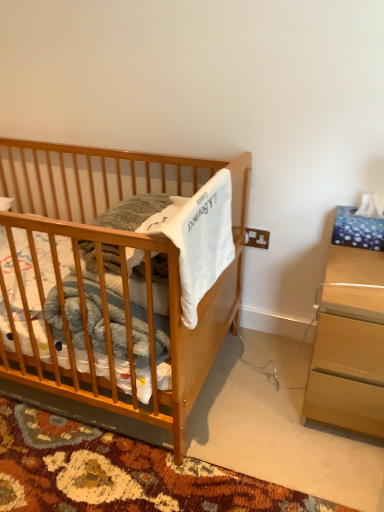
Question: Is light brown wood nightstand at right wider than light brown wooden crib at left?

Choices:
 (A) no
 (B) yes

Answer: (A)

Question: From a real-world perspective, is light brown wood nightstand at right physically above light brown wooden crib at left?

Choices:
 (A) no
 (B) yes

Answer: (A)

Question: Considering the relative sizes of light brown wood nightstand at right and light brown wooden crib at left in the image provided, is light brown wood nightstand at right taller than light brown wooden crib at left?

Choices:
 (A) no
 (B) yes

Answer: (A)

Question: Is light brown wood nightstand at right positioned before light brown wooden crib at left?

Choices:
 (A) no
 (B) yes

Answer: (A)

Question: Are light brown wood nightstand at right and light brown wooden crib at left making contact?

Choices:
 (A) yes
 (B) no

Answer: (B)

Question: Can you confirm if light brown wood nightstand at right is bigger than light brown wooden crib at left?

Choices:
 (A) yes
 (B) no

Answer: (B)

Question: Would you say light brown wood nightstand at right is part of light brown wooden crib at left's contents?

Choices:
 (A) yes
 (B) no

Answer: (B)

Question: From a real-world perspective, does light brown wooden crib at left stand above light brown wood nightstand at right?

Choices:
 (A) yes
 (B) no

Answer: (A)

Question: Does light brown wooden crib at left have a lesser height compared to light brown wood nightstand at right?

Choices:
 (A) no
 (B) yes

Answer: (A)

Question: From the image's perspective, does light brown wooden crib at left appear higher than light brown wood nightstand at right?

Choices:
 (A) yes
 (B) no

Answer: (A)

Question: Considering the relative sizes of light brown wooden crib at left and light brown wood nightstand at right in the image provided, is light brown wooden crib at left bigger than light brown wood nightstand at right?

Choices:
 (A) yes
 (B) no

Answer: (A)

Question: Does light brown wooden crib at left appear on the left side of light brown wood nightstand at right?

Choices:
 (A) no
 (B) yes

Answer: (B)

Question: Considering the relative positions of light brown wood nightstand at right and light brown wooden crib at left in the image provided, is light brown wood nightstand at right to the left or to the right of light brown wooden crib at left?

Choices:
 (A) right
 (B) left

Answer: (A)